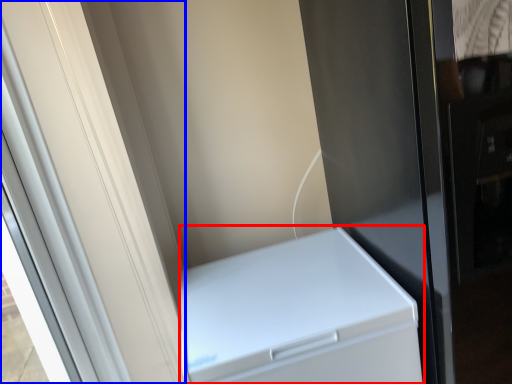
Question: Which point is closer to the camera, home appliance (highlighted by a red box) or screen door (highlighted by a blue box)?

Choices:
 (A) home appliance
 (B) screen door

Answer: (B)